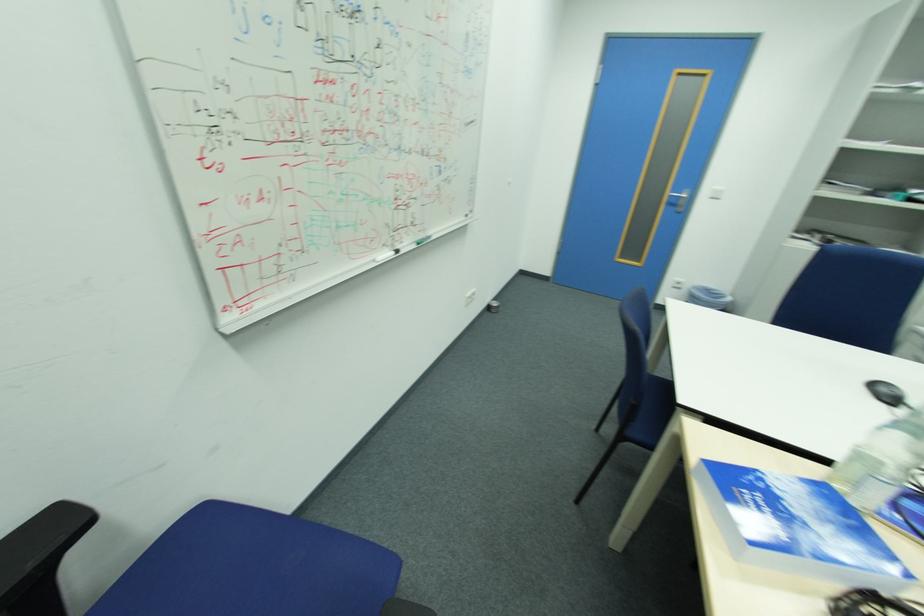
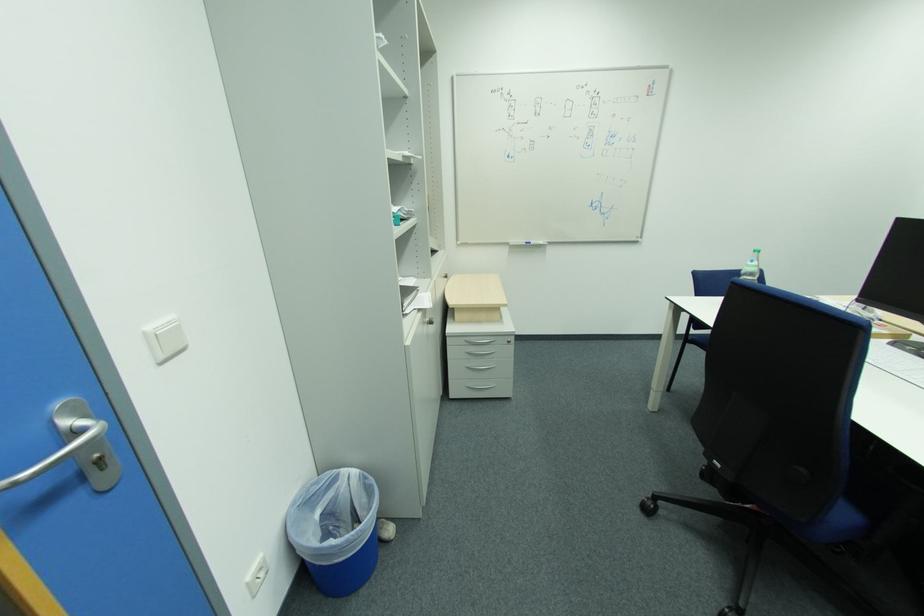
Where in the second image is the point corresponding to (x=686, y=214) from the first image?

(111, 488)